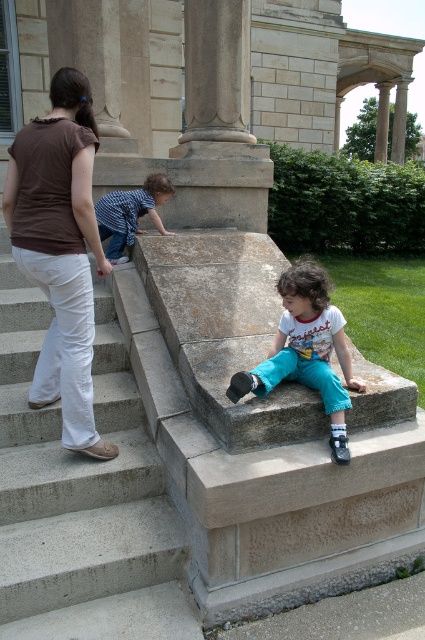
Question: Which is farther from the smooth stone pillar at upper center?

Choices:
 (A) smooth stone column at upper right
 (B) brown cotton shirt at upper left
 (C) smooth stone column at center

Answer: (B)

Question: Where is concrete stairs at center located in relation to smooth stone column at center in the image?

Choices:
 (A) left
 (B) right

Answer: (A)

Question: Is smooth stone column at center bigger than blue denim shirt at upper left?

Choices:
 (A) no
 (B) yes

Answer: (B)

Question: Which point is farther to the camera?

Choices:
 (A) brown cotton shirt at upper left
 (B) blue denim shirt at upper left
 (C) smooth stone column at center
 (D) teal cotton pants at lower center

Answer: (C)

Question: Estimate the real-world distances between objects in this image. Which object is farther from the smooth stone column at upper right?

Choices:
 (A) smooth stone column at center
 (B) blue denim shirt at upper left
 (C) brown cotton shirt at upper left
 (D) concrete stairs at center

Answer: (D)

Question: Considering the relative positions of concrete stairs at center and teal cotton pants at lower center in the image provided, where is concrete stairs at center located with respect to teal cotton pants at lower center?

Choices:
 (A) below
 (B) above

Answer: (A)